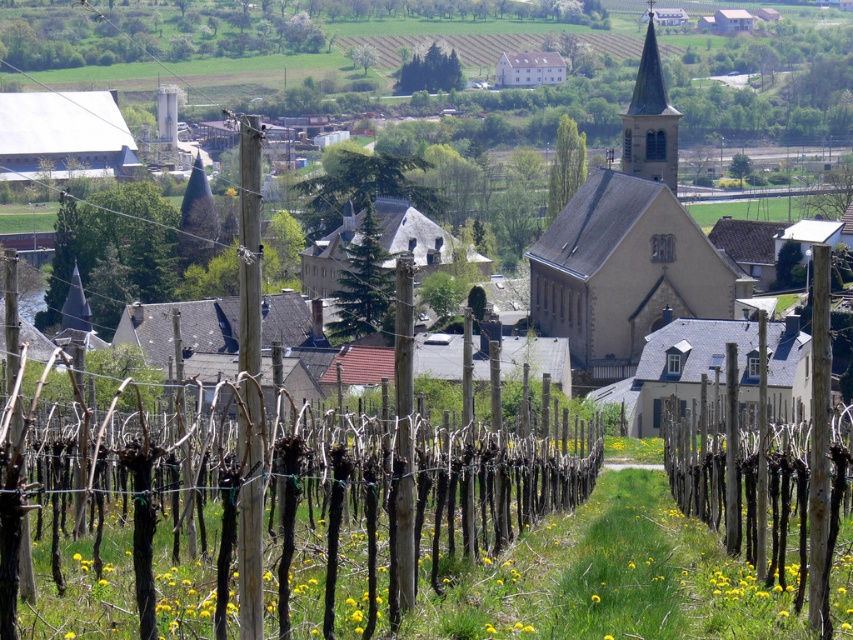
You are planning to build a fence around the stone church at center and the brown wooden pole at center. Which object requires a wider fence to accommodate its width?

The stone church at center requires a wider fence because its width is larger than the brown wooden pole at center.

You are a painter setting up your easel in the rural landscape scene. You want to capture the stone church at center in your painting but also include the brown wooden fence at center. Since you have limited space on your canvas, which object should you draw first to ensure it fits properly?

The brown wooden fence at center is thinner than the stone church at center, so you should draw the stone church at center first to accommodate its larger width before adding the thinner brown wooden fence at center.